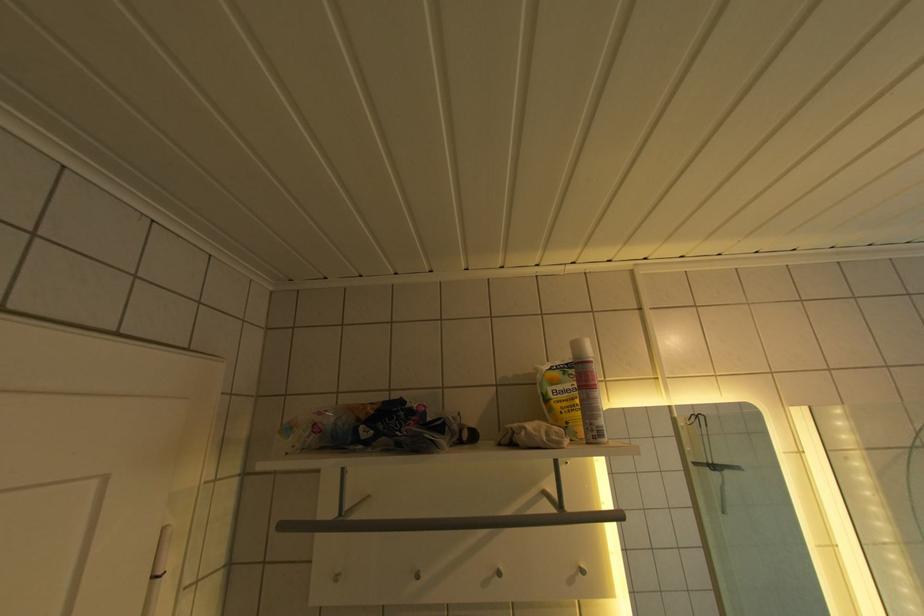
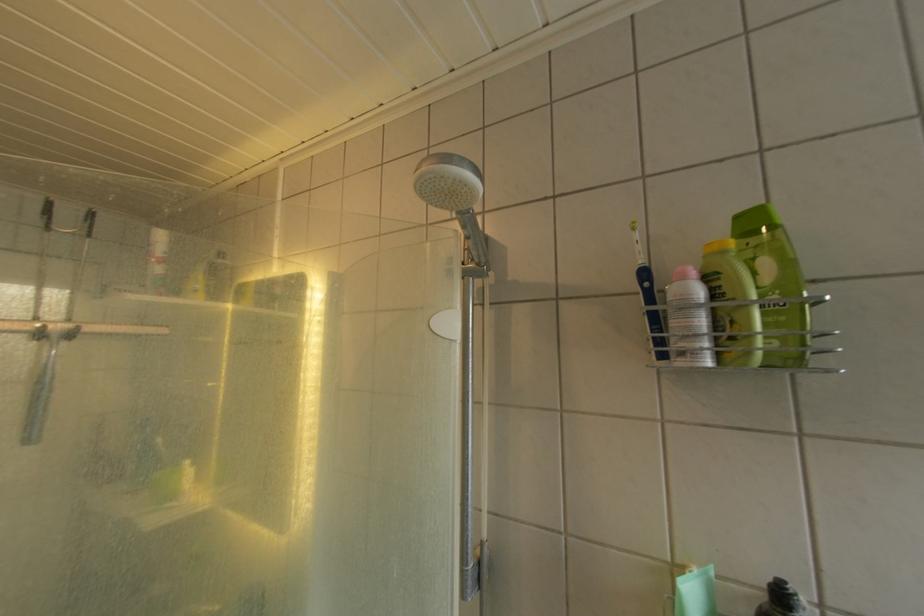
Question: The images are taken continuously from a first-person perspective. In which direction are you moving?

Choices:
 (A) Left
 (B) Right
 (C) Forward
 (D) Backward

Answer: (B)